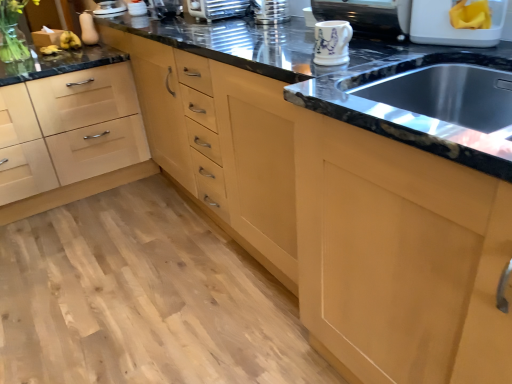
Question: From a real-world perspective, is white plastic container at upper right, which ranks as the 1th appliance in right-to-left order, on top of porcelain mug at upper center, the 3th appliance when ordered from right to left?

Choices:
 (A) no
 (B) yes

Answer: (B)

Question: Considering the relative sizes of white plastic container at upper right, which is counted as the eighth appliance, starting from the left, and porcelain mug at upper center, which is counted as the sixth appliance, starting from the left, in the image provided, is white plastic container at upper right, which is counted as the eighth appliance, starting from the left, smaller than porcelain mug at upper center, which is counted as the sixth appliance, starting from the left,?

Choices:
 (A) yes
 (B) no

Answer: (B)

Question: Can you confirm if white plastic container at upper right, which is counted as the eighth appliance, starting from the left, is shorter than porcelain mug at upper center, which is counted as the sixth appliance, starting from the left?

Choices:
 (A) yes
 (B) no

Answer: (B)

Question: Is white plastic container at upper right, which ranks as the 1th appliance in right-to-left order, at the right side of porcelain mug at upper center, which is counted as the sixth appliance, starting from the left?

Choices:
 (A) yes
 (B) no

Answer: (A)

Question: From the image's perspective, is white plastic container at upper right, which is counted as the eighth appliance, starting from the left, located beneath porcelain mug at upper center, the 3th appliance when ordered from right to left?

Choices:
 (A) yes
 (B) no

Answer: (B)

Question: Looking at their shapes, would you say matte white squash at upper left, the first appliance in the left-to-right sequence, is wider or thinner than black granite sink at center?

Choices:
 (A) wide
 (B) thin

Answer: (B)

Question: Considering the positions of point (84, 43) and point (312, 97), is point (84, 43) closer or farther from the camera than point (312, 97)?

Choices:
 (A) farther
 (B) closer

Answer: (A)

Question: Considering the positions of matte white squash at upper left, the eighth appliance in the right-to-left sequence, and black granite sink at center in the image, is matte white squash at upper left, the eighth appliance in the right-to-left sequence, bigger or smaller than black granite sink at center?

Choices:
 (A) small
 (B) big

Answer: (A)

Question: From their relative heights in the image, would you say matte white squash at upper left, the eighth appliance in the right-to-left sequence, is taller or shorter than black granite sink at center?

Choices:
 (A) short
 (B) tall

Answer: (A)

Question: From the image's perspective, is light wood drawer at lower left above or below black granite sink at center?

Choices:
 (A) below
 (B) above

Answer: (B)

Question: In the image, is light wood drawer at lower left on the left side or the right side of black granite sink at center?

Choices:
 (A) left
 (B) right

Answer: (A)

Question: Considering their positions, is light wood drawer at lower left located in front of or behind black granite sink at center?

Choices:
 (A) behind
 (B) front

Answer: (A)

Question: Looking at the image, does light wood drawer at lower left seem bigger or smaller compared to black granite sink at center?

Choices:
 (A) small
 (B) big

Answer: (B)

Question: Looking at their shapes, would you say white glossy mug at upper center, the seventh appliance in the left-to-right sequence, is wider or thinner than clear glass vase at upper left?

Choices:
 (A) wide
 (B) thin

Answer: (B)

Question: From a real-world perspective, is white glossy mug at upper center, the seventh appliance in the left-to-right sequence, physically located above or below clear glass vase at upper left?

Choices:
 (A) below
 (B) above

Answer: (B)